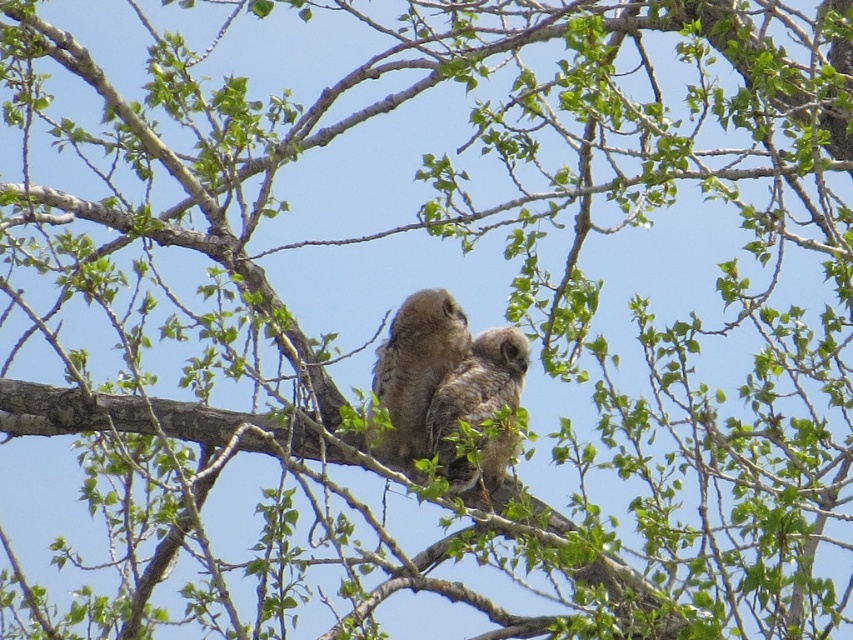
Question: Is brown fuzzy owl at center thinner than brown fluffy owl at center?

Choices:
 (A) yes
 (B) no

Answer: (A)

Question: Which point is farther from the camera taking this photo?

Choices:
 (A) pyautogui.click(x=445, y=344)
 (B) pyautogui.click(x=490, y=413)

Answer: (A)

Question: Where is brown fuzzy owl at center located in relation to brown fluffy owl at center in the image?

Choices:
 (A) right
 (B) left

Answer: (B)

Question: In this image, where is brown fuzzy owl at center located relative to brown fluffy owl at center?

Choices:
 (A) below
 (B) above

Answer: (B)